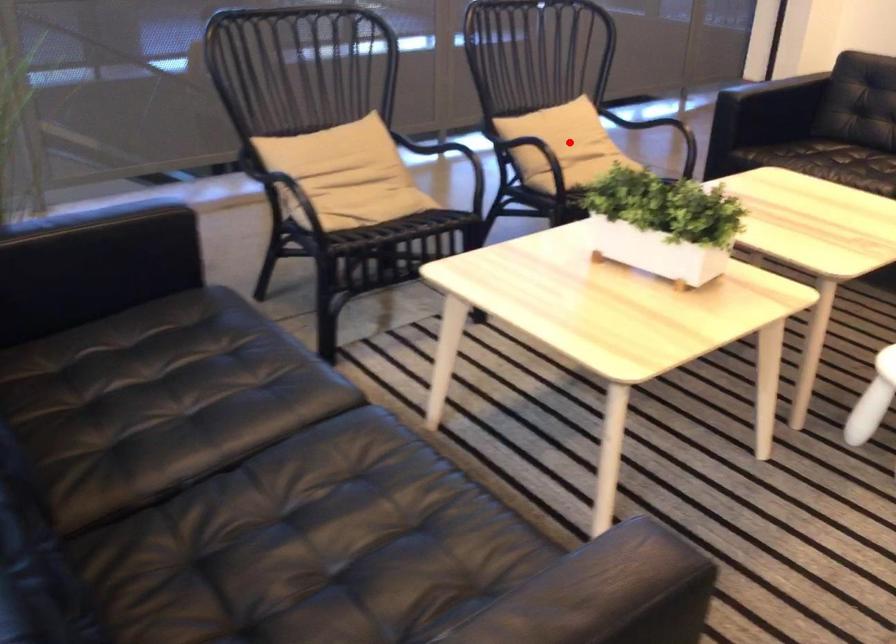
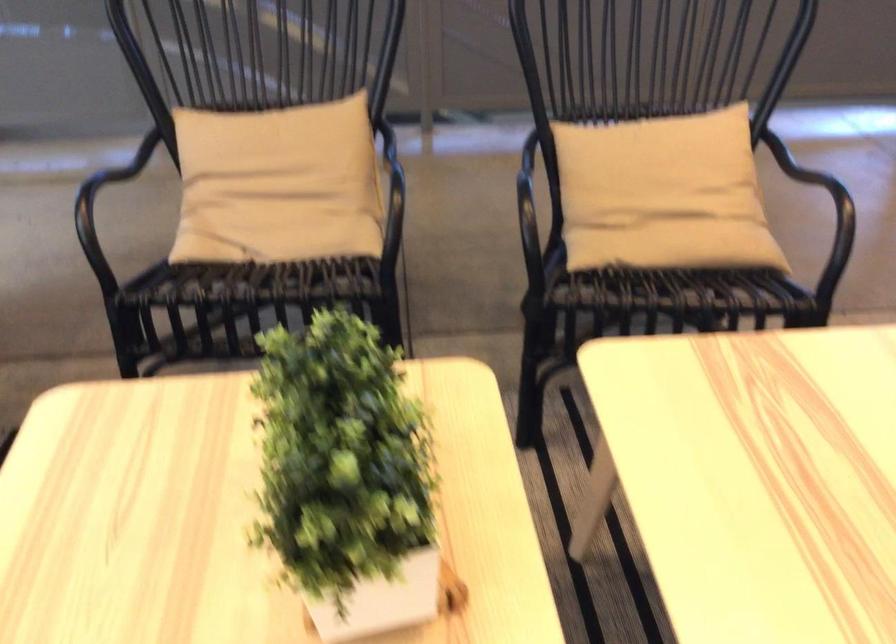
Question: I am providing you with two images of the same scene from different viewpoints. Given a red point in image1, look at the same physical point in image2. Is it:

Choices:
 (A) Closer to the viewpoint
 (B) Farther from the viewpoint

Answer: (A)